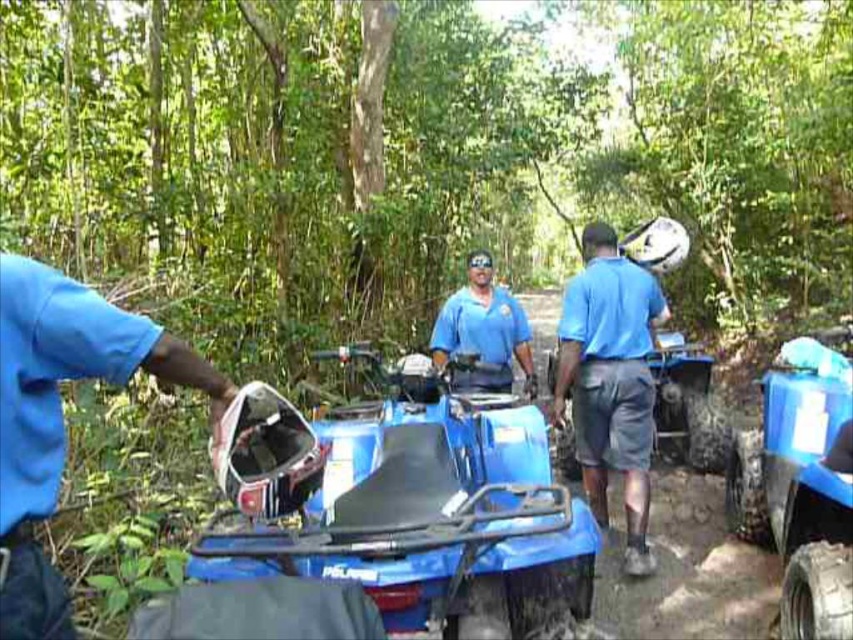
You are an ATV rider preparing to ride the blue plastic motorcycle at center. You notice a blue matte helmet at left nearby. Can you reach the helmet without moving from your current position? Please explain based on the distance between them.

The blue plastic motorcycle at center and the blue matte helmet at left are 39.33 inches apart. Since this distance is greater than an average person can reach, you cannot reach the helmet without moving from your current position.

You are an observer in the forest scene. You notice two people wearing blue fabric shorts at center and matte blue shirt at center. Which clothing item is positioned lower on the person?

The blue fabric shorts at center is located below matte blue shirt at center, so the blue fabric shorts at center is positioned lower on the person.